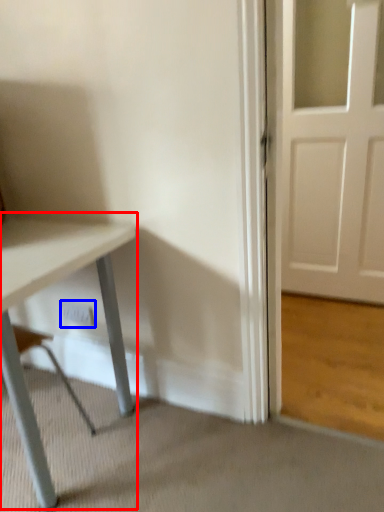
Question: Among these objects, which one is nearest to the camera, table (highlighted by a red box) or electric outlet (highlighted by a blue box)?

Choices:
 (A) table
 (B) electric outlet

Answer: (A)